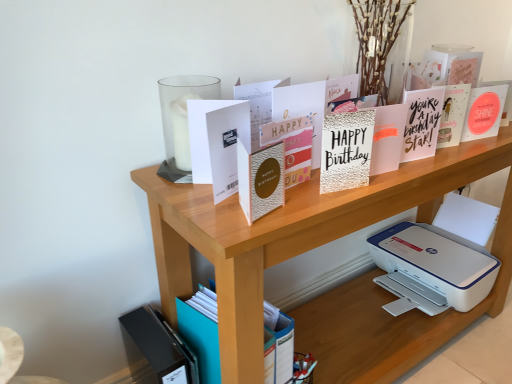
Identify the location of unoccupied region to the right of white textured card at center, the 2th paperback book viewed from the right. This screenshot has height=384, width=512. (425, 167).